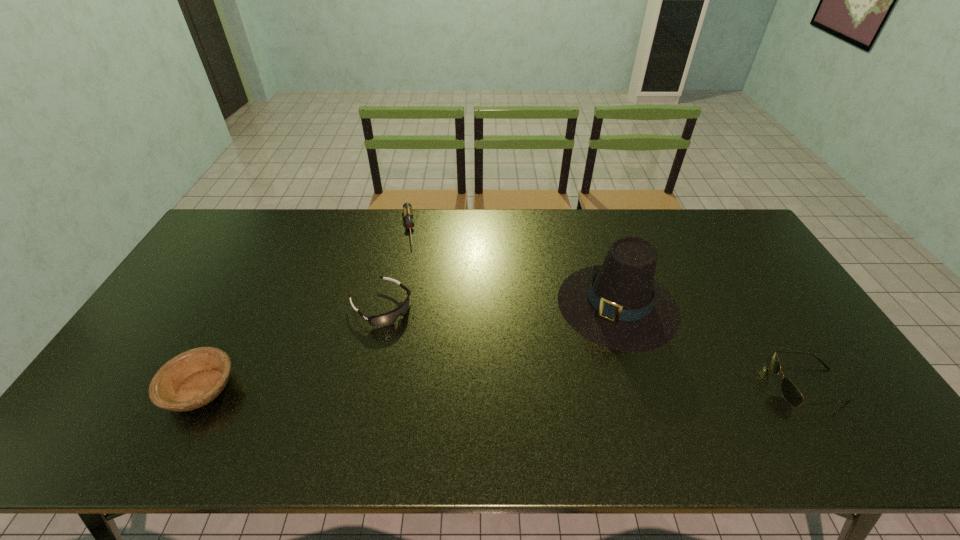
The image size is (960, 540). Identify the location of free space at the right edge of the desktop. (765, 262).

Find the location of a particular element. The height and width of the screenshot is (540, 960). free space at the far left corner of the desktop is located at coordinates (243, 222).

This screenshot has height=540, width=960. I want to click on free point between the goggles and the rightmost object, so click(593, 346).

Image resolution: width=960 pixels, height=540 pixels. What are the coordinates of `vacant area that lies between the leftmost object and the goggles` in the screenshot? It's located at (291, 348).

You are a GUI agent. You are given a task and a screenshot of the screen. Output one action in this format:
    pyautogui.click(x=<x>, y=<y>)
    Task: Click on the vacant space that is in between the screwdriver and the goggles
    
    Given the screenshot: What is the action you would take?
    pyautogui.click(x=395, y=267)

Where is `free spot between the goggles and the bowl`? The image size is (960, 540). free spot between the goggles and the bowl is located at coordinates (291, 348).

In order to click on vacant area between the sunglasses and the goggles in this screenshot , I will do `click(593, 346)`.

I want to click on free space between the rightmost object and the goggles, so click(593, 346).

You are a GUI agent. You are given a task and a screenshot of the screen. Output one action in this format:
    pyautogui.click(x=<x>, y=<y>)
    Task: Click on the vacant region between the hat and the bowl
    The height and width of the screenshot is (540, 960).
    Given the screenshot: What is the action you would take?
    (x=409, y=347)

Where is `empty location between the bowl and the sunglasses`? This screenshot has height=540, width=960. empty location between the bowl and the sunglasses is located at coordinates (503, 387).